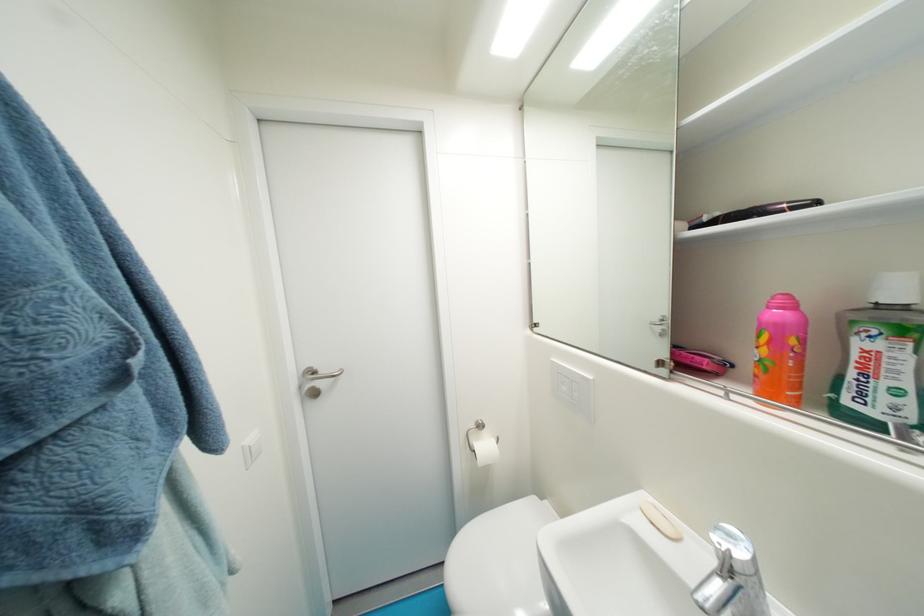
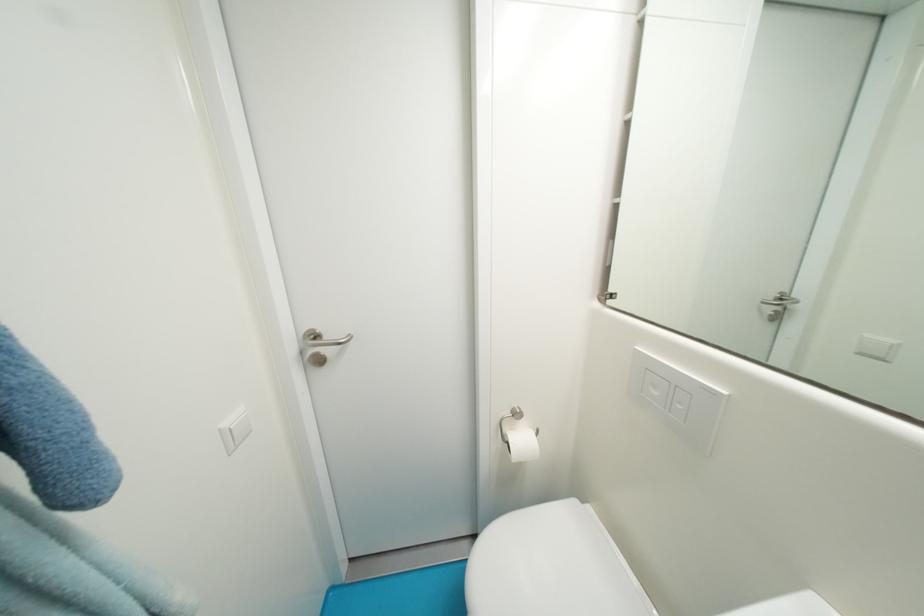
Locate, in the second image, the point that corresponds to (492,448) in the first image.

(529, 442)